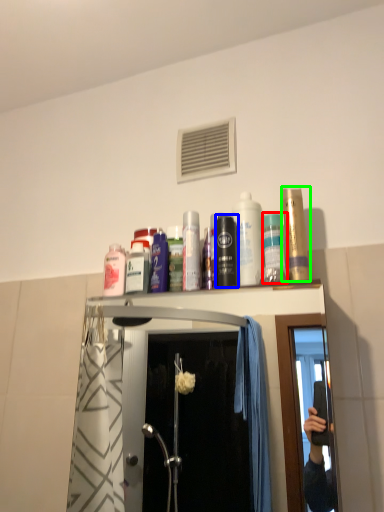
Question: Based on their relative distances, which object is nearer to mouthwash (highlighted by a red box)? Choose from mouthwash (highlighted by a blue box) and mouthwash (highlighted by a green box).

Choices:
 (A) mouthwash
 (B) mouthwash

Answer: (B)